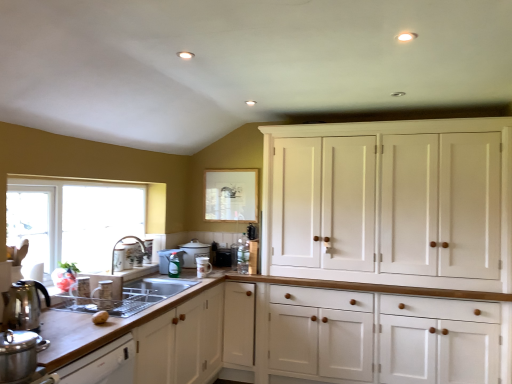
The height and width of the screenshot is (384, 512). Identify the location of vacant region to the left of brown matte potato at lower left. (69, 314).